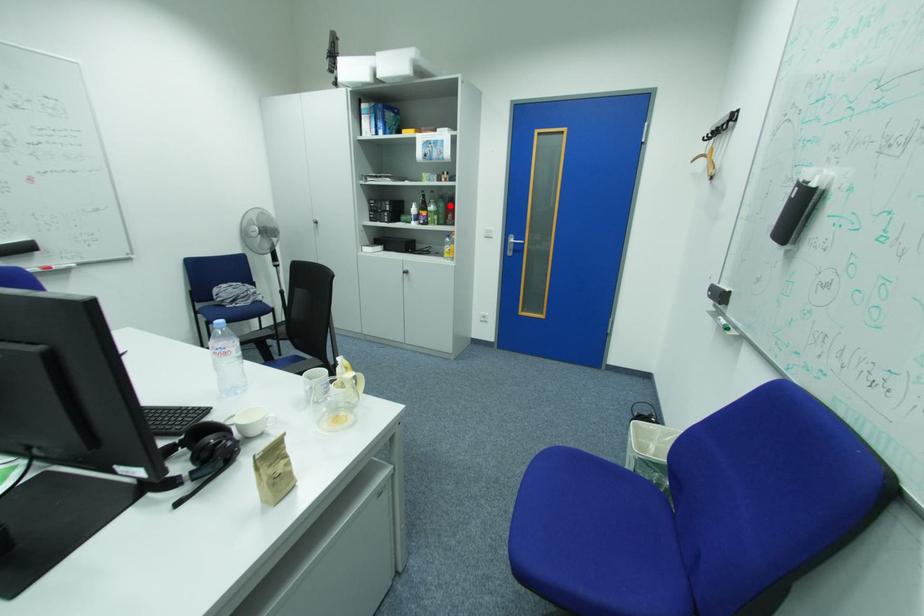
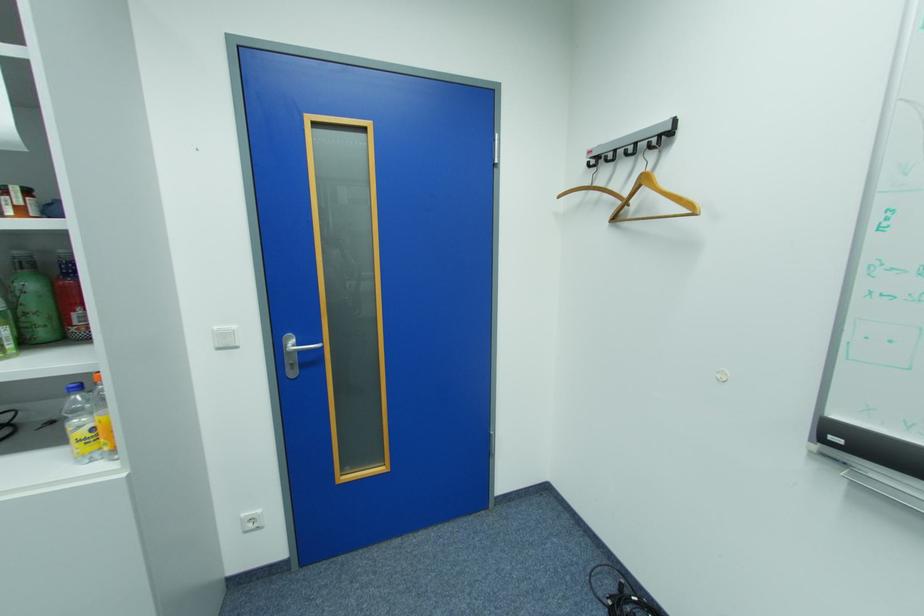
Question: I am providing you with two images of the same scene from different viewpoints. In image1, a red point is highlighted. Considering the same 3D point in image2, which of the following is correct?

Choices:
 (A) It is closer
 (B) It is farther

Answer: (B)